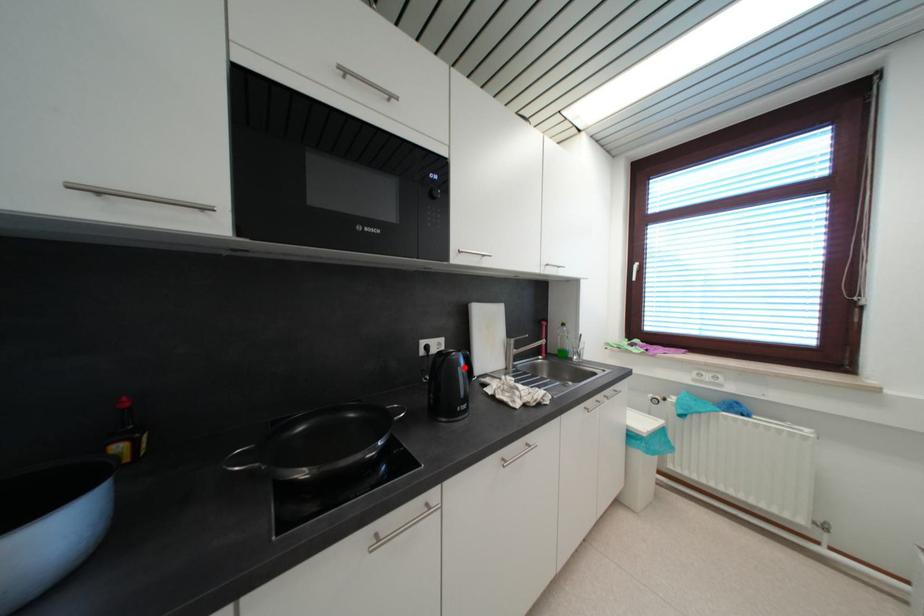
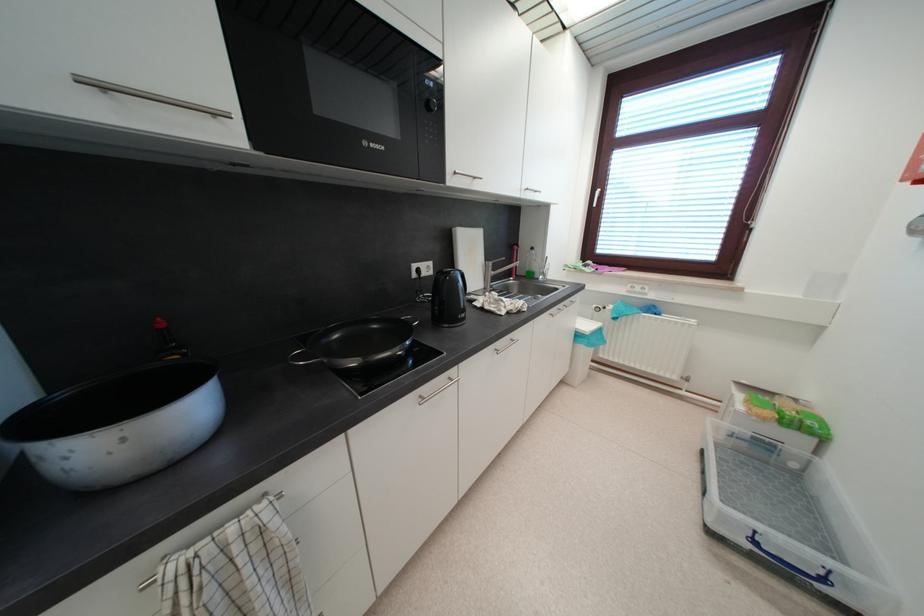
Find the pixel in the second image that matches the highlighted location in the first image.

(464, 284)